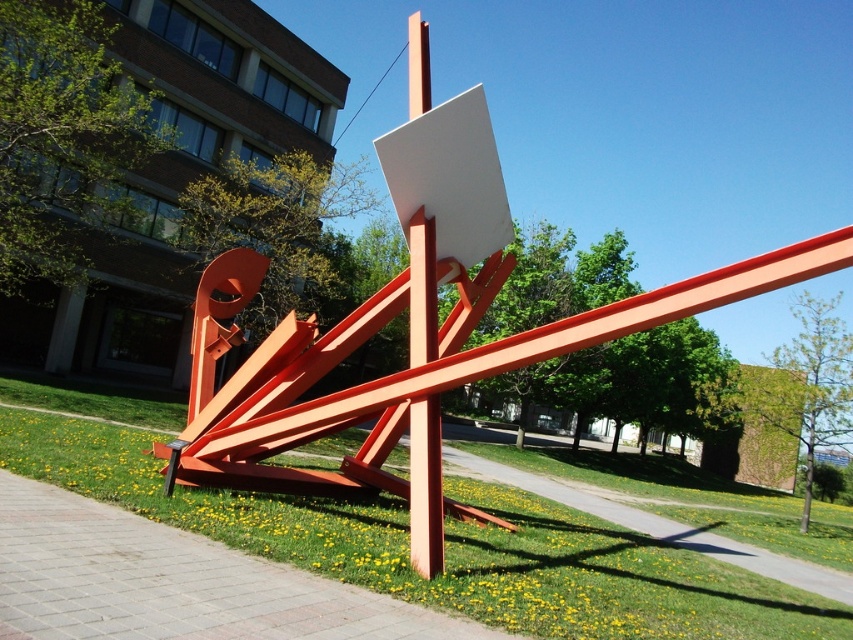
Is point (434, 365) behind point (410, 529)?

No, (434, 365) is closer to viewer.

Describe the element at coordinates (415, 326) in the screenshot. I see `orange metallic sculpture at center` at that location.

I want to click on orange metallic sculpture at center, so click(415, 326).

Between orange metallic sculpture at center and green grass at lower center, which one has more height?

green grass at lower center

What do you see at coordinates (415, 326) in the screenshot? I see `orange metallic sculpture at center` at bounding box center [415, 326].

Where is `orange metallic sculpture at center`? The image size is (853, 640). orange metallic sculpture at center is located at coordinates (415, 326).

Is green grass at lower center wider than matte orange pole at center?

Yes, green grass at lower center is wider than matte orange pole at center.

Who is higher up, green grass at lower center or matte orange pole at center?

matte orange pole at center is above.

At what (x,y) coordinates should I click in order to perform the action: click on green grass at lower center. Please return your answer as a coordinate pair (x, y). Looking at the image, I should click on (445, 547).